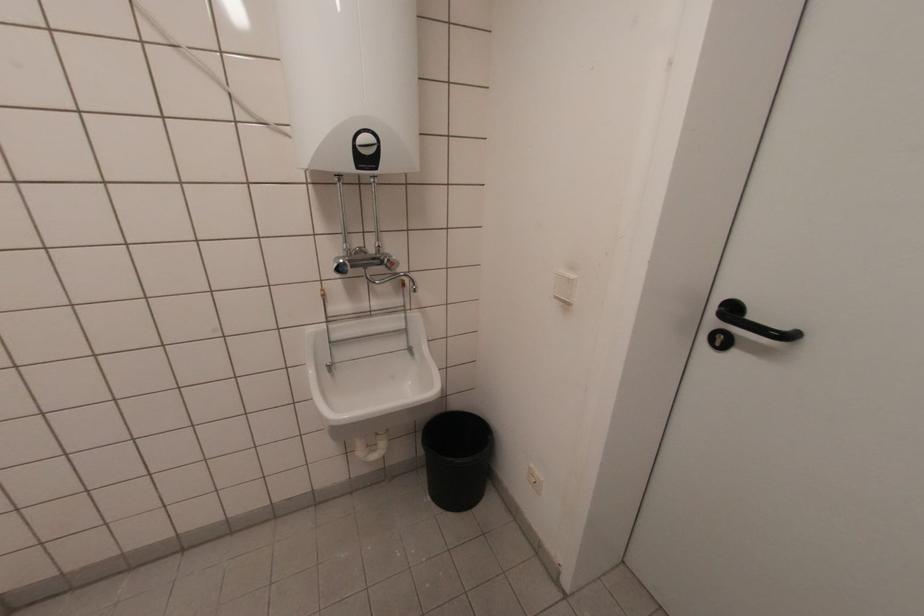
Find where to turn the red faucet knob. Please return your answer as a coordinate pair (x, y).

(390, 262)